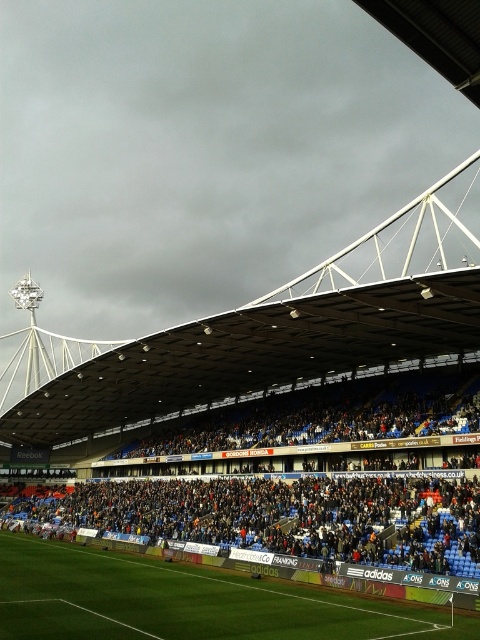
You are a drone operator tasked with capturing aerial footage of the stadium. Your drone is currently hovering at the center of the stadium. You need to fly it to the dark blue seats at lower center. What are the coordinates you should input into the drone to reach them?

The coordinates to reach the dark blue seats at lower center are point (299, 504).

You are a drone operator tasked with capturing aerial footage of the sports stadium. Your camera is currently positioned above the point at coordinates point (x=299, y=504). The drone needs to fly directly to the green pitch visible at the bottom of the frame. Which direction should the drone move to reach the green pitch?

The point (x=299, y=504) is located on dark blue seats at lower center. Since the green pitch is at the bottom of the frame, the drone should move downward from the point (x=299, y=504) to reach the green pitch.

You are a drone operator trying to capture aerial footage of the stadium. You have two points marked on your screen for camera positioning. The first point is at coordinate point(374,497) and the second is at point(228,628). From the perspective of someone standing at the center of the stadium field, which point is closer to the front of the stadium?

Point(228,628) is closer to the front of the stadium because it is in front of point(374,497).